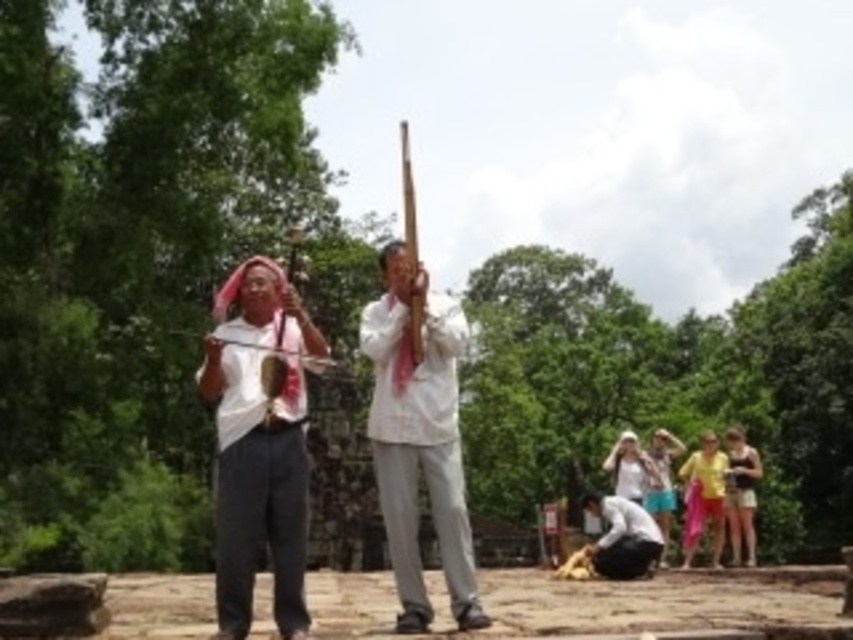
You are standing at the center of the stone platform and want to place a small vase exactly at the point marked by the white matte shirt at center. Can you confirm if the white matte shirt at center is located at the coordinates point (259,445)?

Yes, the white matte shirt at center is located at point (259,445).